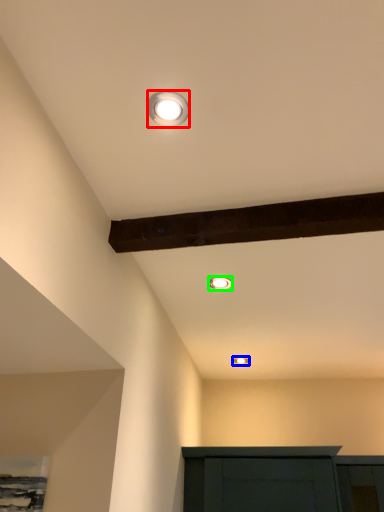
Question: Based on their relative distances, which object is farther from lamp (highlighted by a red box)? Choose from lamp (highlighted by a blue box) and lamp (highlighted by a green box).

Choices:
 (A) lamp
 (B) lamp

Answer: (A)